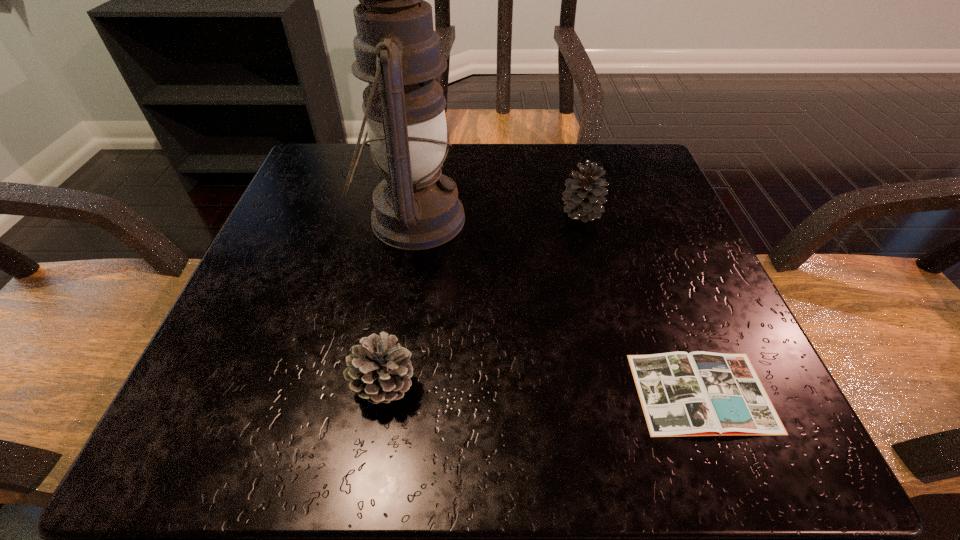
I want to click on oil lamp positioned at the far edge, so click(397, 52).

Image resolution: width=960 pixels, height=540 pixels. Find the location of `pinecone that is at the far edge`. pinecone that is at the far edge is located at coordinates (584, 196).

Locate an element on the screen. The image size is (960, 540). pinecone present at the near edge is located at coordinates (380, 372).

The height and width of the screenshot is (540, 960). In order to click on book that is at the near edge in this screenshot , I will do `click(699, 393)`.

You are a GUI agent. You are given a task and a screenshot of the screen. Output one action in this format:
    pyautogui.click(x=<x>, y=<y>)
    Task: Click on the object that is at the left edge
    Image resolution: width=960 pixels, height=540 pixels.
    Given the screenshot: What is the action you would take?
    pyautogui.click(x=397, y=52)

Identify the location of pinecone at the right edge. (584, 196).

Locate an element on the screen. Image resolution: width=960 pixels, height=540 pixels. book present at the right edge is located at coordinates (699, 393).

The width and height of the screenshot is (960, 540). Identify the location of object that is at the far left corner. pyautogui.click(x=397, y=52).

Find the location of a particular element. This screenshot has height=540, width=960. object situated at the far right corner is located at coordinates (584, 196).

Locate an element on the screen. object positioned at the near right corner is located at coordinates (699, 393).